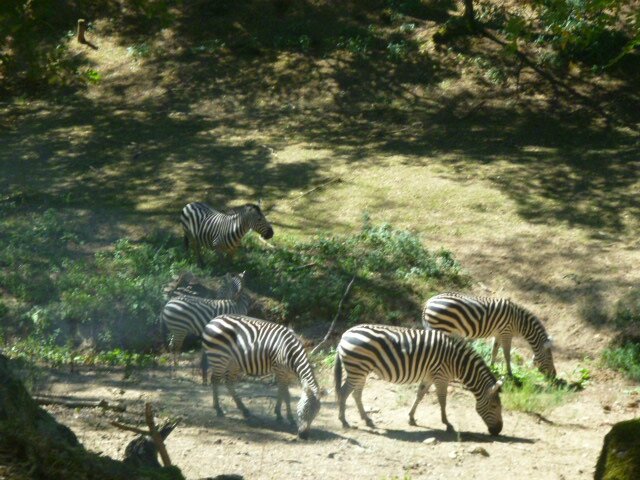
The image size is (640, 480). What are the coordinates of `green plants` in the screenshot? It's located at 393,244, 140,273, 80,311.